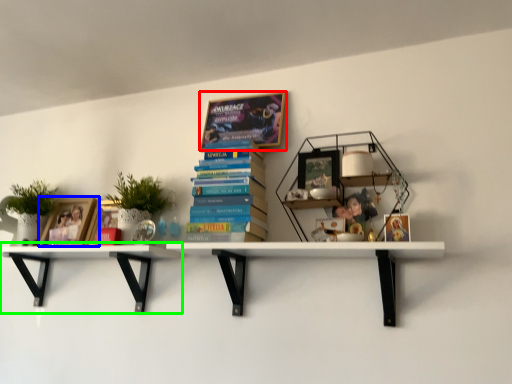
Question: Estimate the real-world distances between objects in this image. Which object is closer to book (highlighted by a red box), book cover (highlighted by a blue box) or shelf (highlighted by a green box)?

Choices:
 (A) book cover
 (B) shelf

Answer: (B)